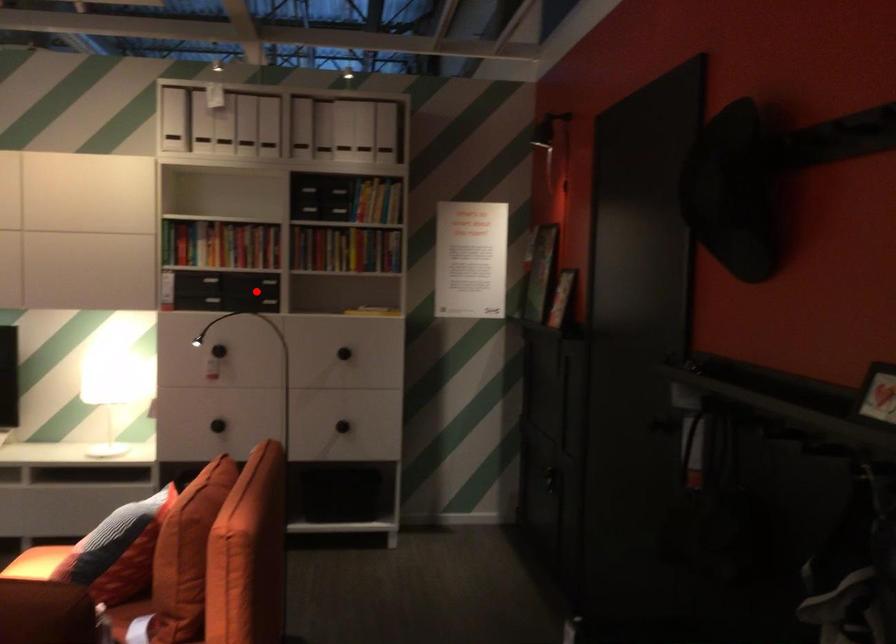
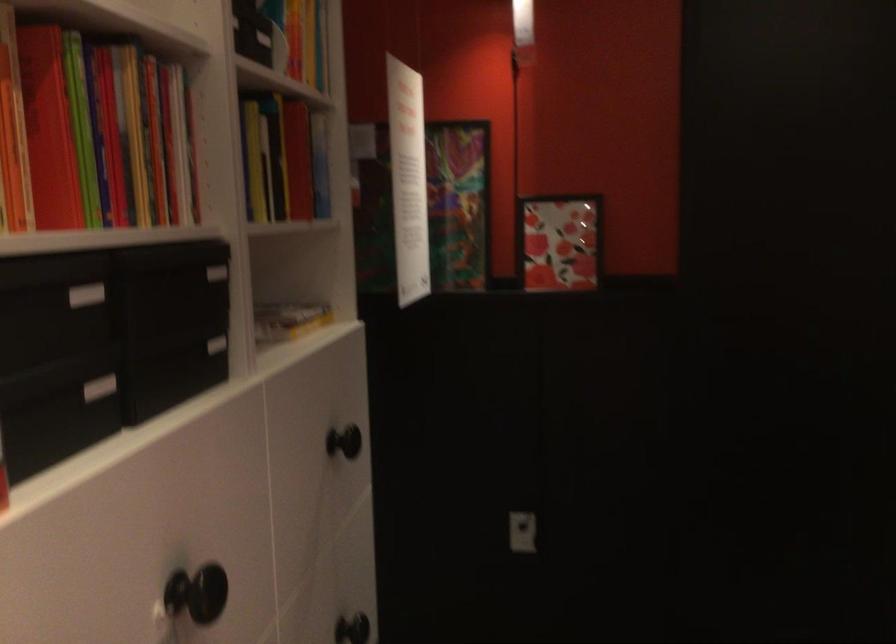
In the second image, find the point that corresponds to the highlighted location in the first image.

(216, 345)